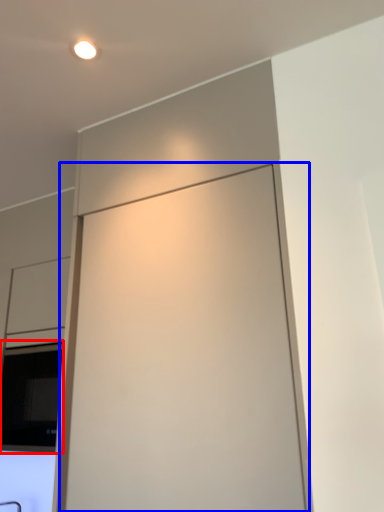
Question: Which object is further to the camera taking this photo, window (highlighted by a red box) or screen door (highlighted by a blue box)?

Choices:
 (A) window
 (B) screen door

Answer: (A)